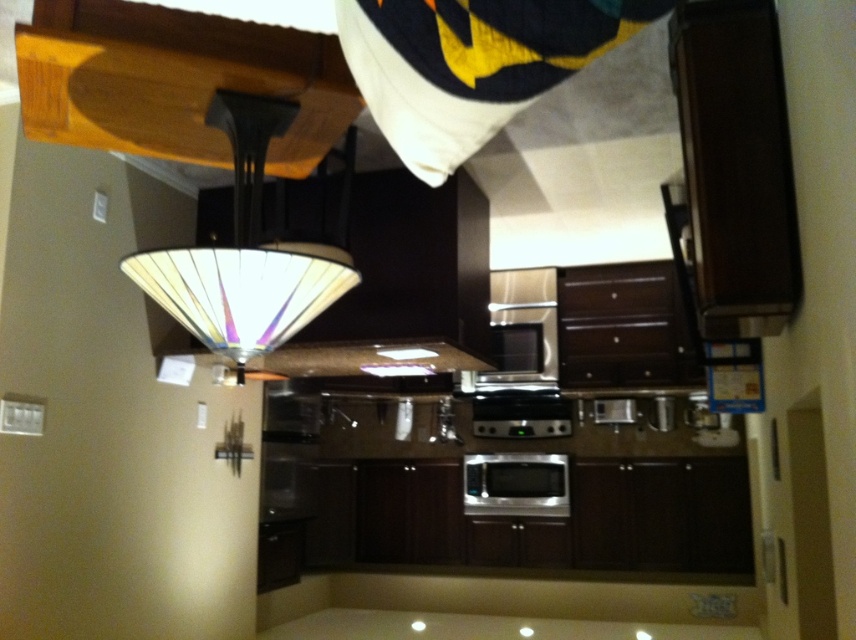
You are a delivery person who needs to place a new oven in the kitchen. The new oven is exactly the same size as the satin silver oven at center. The delivery truck is parked 4 meters away from the kitchen entrance. Can you maneuver the new oven through the kitchen to replace the existing one without hitting the translucent glass lampshade at upper center?

The translucent glass lampshade at upper center is 3.90 meters from the satin silver oven at center. Since the delivery truck is parked 4 meters away, the distance is sufficient, but you must ensure the path to the oven does not pass under the lampshade to avoid collision. The lampshade is only 3.90 meters away from the oven, so if the oven is moved in a straight path, there should be enough clearance as the distance from the truck is slightly more than the required 3.90 meters. However, precise maneuvering

You are a home decorator planning to place a new decorative item between the translucent glass lampshade at upper center and the satin silver oven at center. Which side of the oven should you place it on?

You should place the decorative item to the left side of the satin silver oven at center because the translucent glass lampshade at upper center is already positioned to its left.

You are a delivery person who needs to place a small package on the satin silver oven at center. However, there is a translucent glass lampshade at upper center hanging above the oven. Can you safely place the package on the oven without touching the lampshade?

The translucent glass lampshade at upper center is closer to the viewer than the satin silver oven at center, so there is enough space between them to safely place the package on the oven without touching the lampshade.